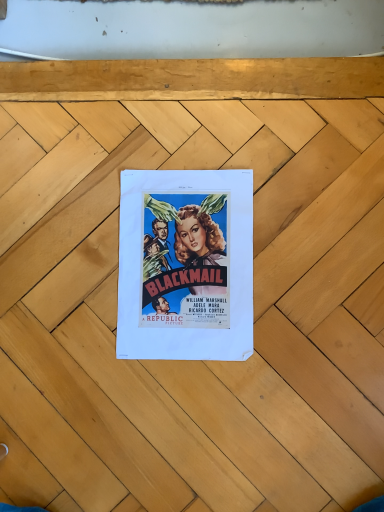
I want to click on matte paper poster at center, so click(185, 265).

What do you see at coordinates (185, 265) in the screenshot? This screenshot has height=512, width=384. I see `matte paper poster at center` at bounding box center [185, 265].

Locate an element on the screen. Image resolution: width=384 pixels, height=512 pixels. matte paper poster at center is located at coordinates (185, 265).